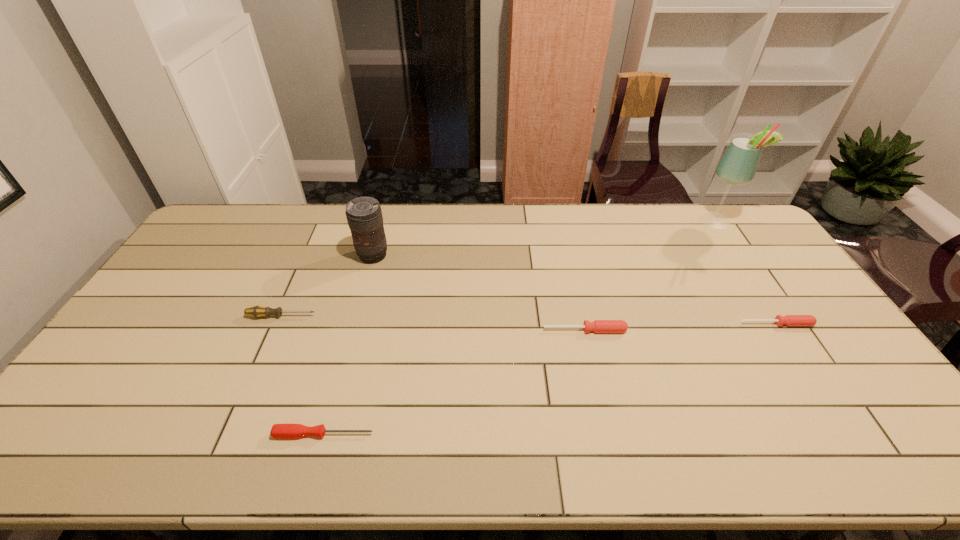
At what (x,y) coordinates should I click in order to perform the action: click on vacant space located on the side of the telephoto lens where the control switches are located. Please return your answer as a coordinate pair (x, y). Looking at the image, I should click on (357, 313).

This screenshot has width=960, height=540. What are the coordinates of `free location located at the tip of the leftmost object` in the screenshot? It's located at (396, 316).

Where is `blank area located 0.160m on the back of the third object from right to left`? blank area located 0.160m on the back of the third object from right to left is located at coordinates (575, 288).

Locate an element on the screen. This screenshot has height=540, width=960. vacant space located 0.380m on the front of the rightmost screwdriver is located at coordinates (861, 455).

The height and width of the screenshot is (540, 960). What are the coordinates of `vacant area situated at the tip of the third screwdriver from right to left` in the screenshot? It's located at (428, 434).

At what (x,y) coordinates should I click in order to perform the action: click on object located at the far edge. Please return your answer as a coordinate pair (x, y). Image resolution: width=960 pixels, height=540 pixels. Looking at the image, I should click on (738, 165).

The height and width of the screenshot is (540, 960). I want to click on object that is at the near edge, so click(278, 431).

Locate an element on the screen. The height and width of the screenshot is (540, 960). alcohol that is at the right edge is located at coordinates (738, 165).

Where is `screwdriver located in the right edge section of the desktop`? The height and width of the screenshot is (540, 960). screwdriver located in the right edge section of the desktop is located at coordinates (789, 320).

Identify the location of object that is at the far right corner. This screenshot has height=540, width=960. (738, 165).